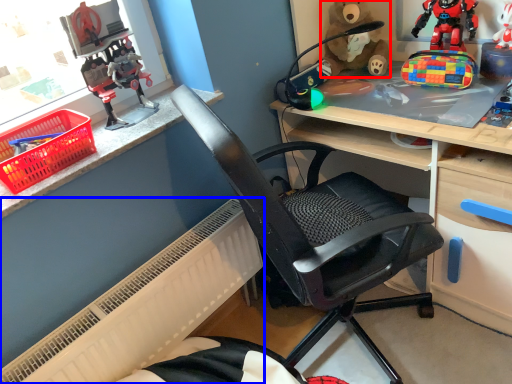
Question: Which of the following is the closest to the observer, doll (highlighted by a red box) or radiator (highlighted by a blue box)?

Choices:
 (A) doll
 (B) radiator

Answer: (B)